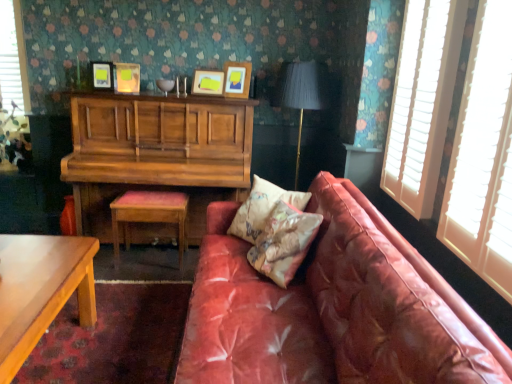
Image resolution: width=512 pixels, height=384 pixels. Identify the location of vacant area in front of matte yellow picture frame at upper center, the 2th picture frame viewed from the left. (124, 95).